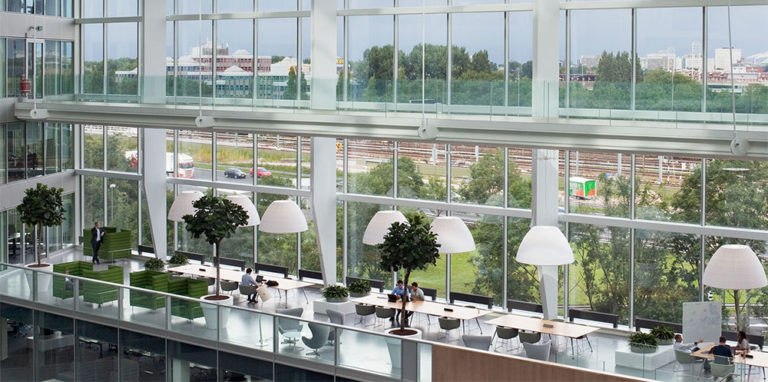
The image size is (768, 382). Find the location of `light fixtures`. light fixtures is located at coordinates (181, 209), (247, 209), (277, 218), (379, 226), (452, 239), (545, 248), (722, 269).